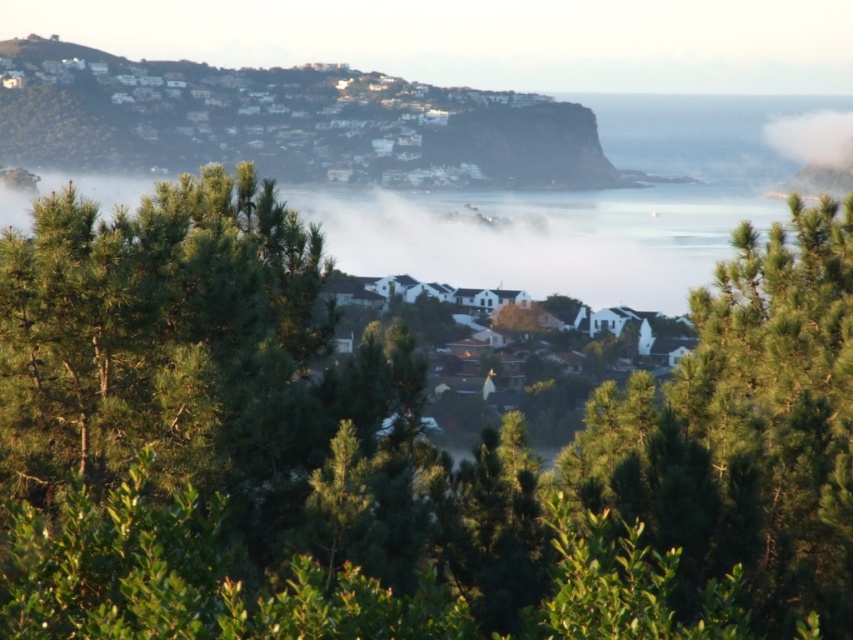
Between point (283, 579) and point (849, 161), which one is positioned behind?

Positioned behind is point (849, 161).

Does green leafy tree at center appear on the left side of white fluffy cloud at upper right?

Indeed, green leafy tree at center is positioned on the left side of white fluffy cloud at upper right.

The image size is (853, 640). I want to click on green leafy tree at center, so click(x=397, y=449).

Who is higher up, green leafy tree at center or white matte houses at center?

green leafy tree at center is above.

The image size is (853, 640). Describe the element at coordinates (397, 449) in the screenshot. I see `green leafy tree at center` at that location.

Between point (276, 381) and point (613, 333), which one is positioned behind?

Point (613, 333)

This screenshot has height=640, width=853. I want to click on green leafy tree at center, so 397,449.

Between white matte houses at center and white fluffy cloud at upper right, which one is positioned higher?

white fluffy cloud at upper right is above.

Who is lower down, white matte houses at center or white fluffy cloud at upper right?

white matte houses at center

Image resolution: width=853 pixels, height=640 pixels. In order to click on white matte houses at center in this screenshot , I will do `click(550, 365)`.